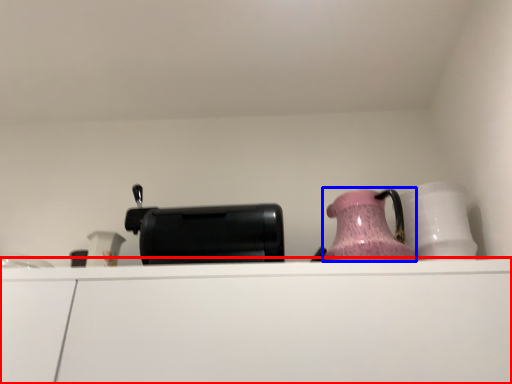
Question: Which object is closer to the camera taking this photo, cabinetry (highlighted by a red box) or jug (highlighted by a blue box)?

Choices:
 (A) cabinetry
 (B) jug

Answer: (A)